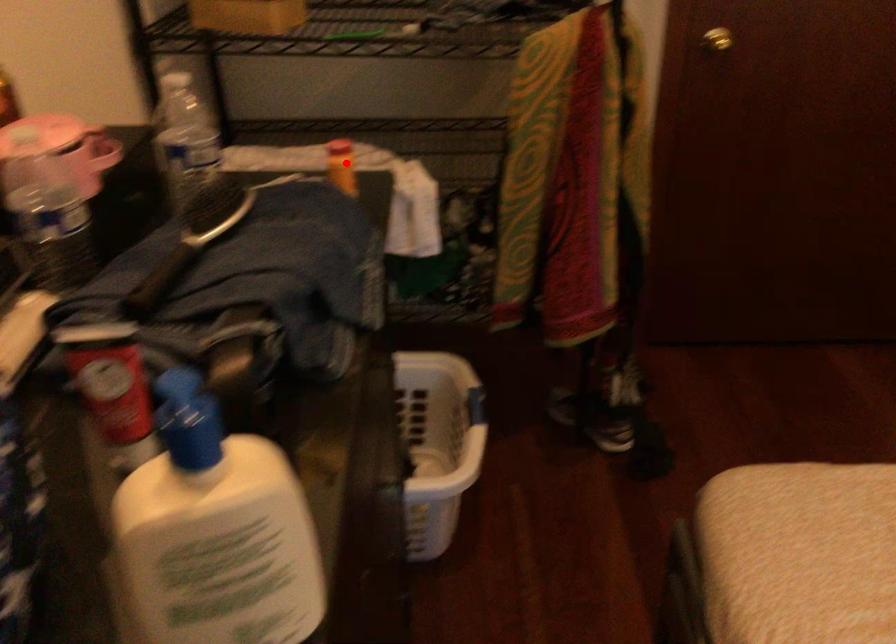
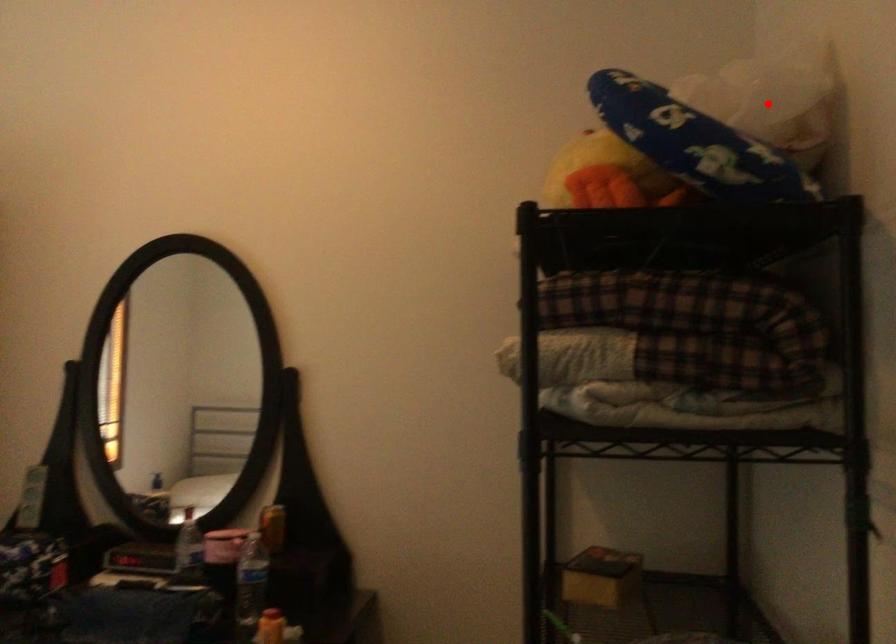
I am providing you with two images of the same scene from different viewpoints. A red point is marked on the first image and another point is marked on the second image. Is the marked point in image1 the same physical position as the marked point in image2?

No